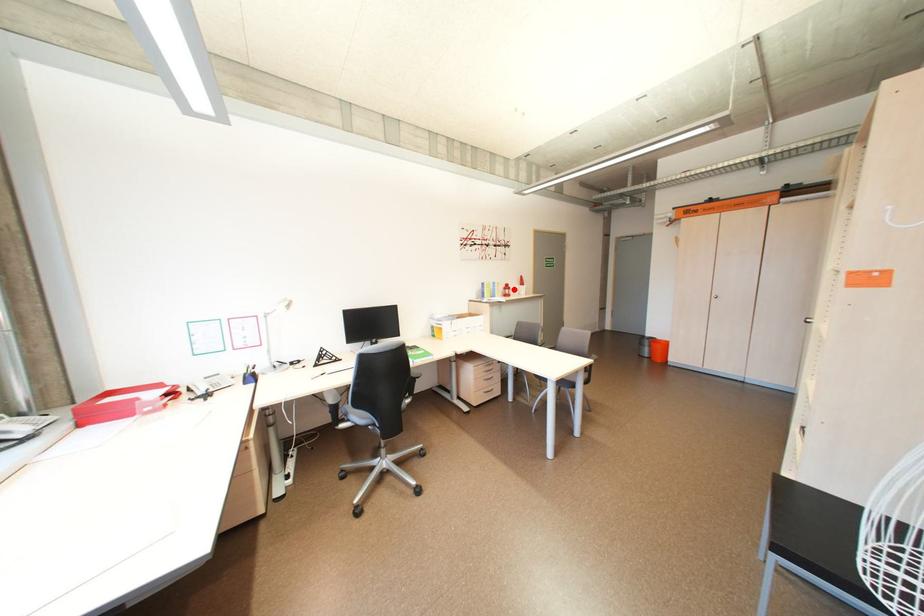
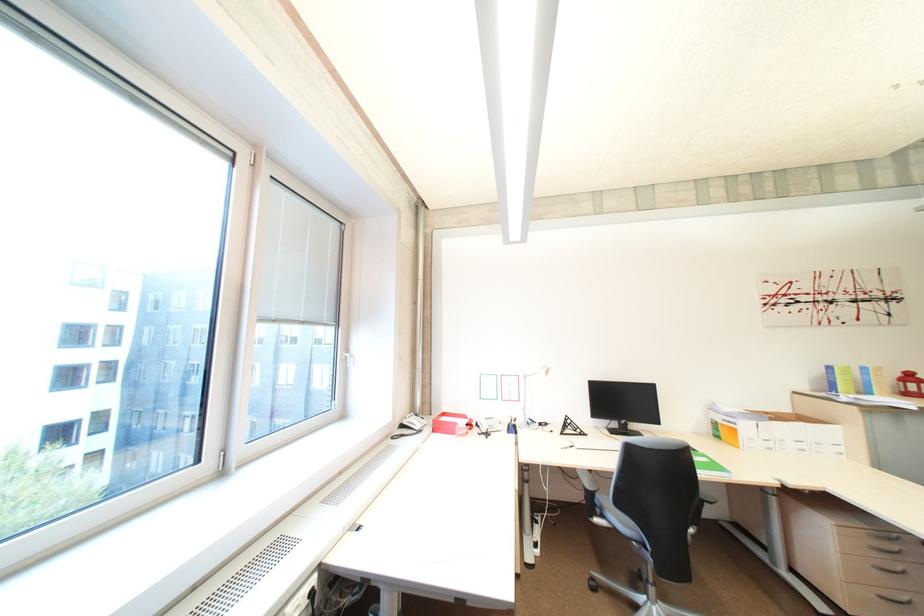
Question: I am providing you with two images of the same scene from different viewpoints. Image1 has a red point marked. In image2, the corresponding 3D location appears at what relative position? Reply with the corresponding letter.

Choices:
 (A) Closer
 (B) Farther

Answer: (A)